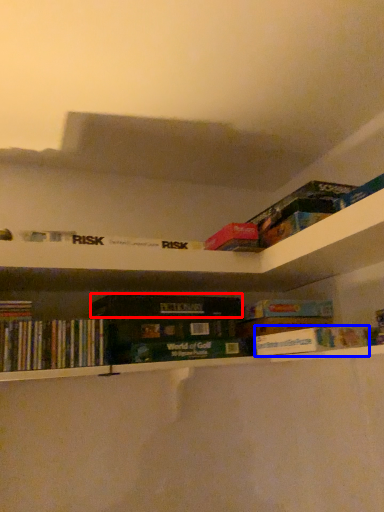
Question: Which object appears closest to the camera in this image, paperback book (highlighted by a red box) or book (highlighted by a blue box)?

Choices:
 (A) paperback book
 (B) book

Answer: (B)